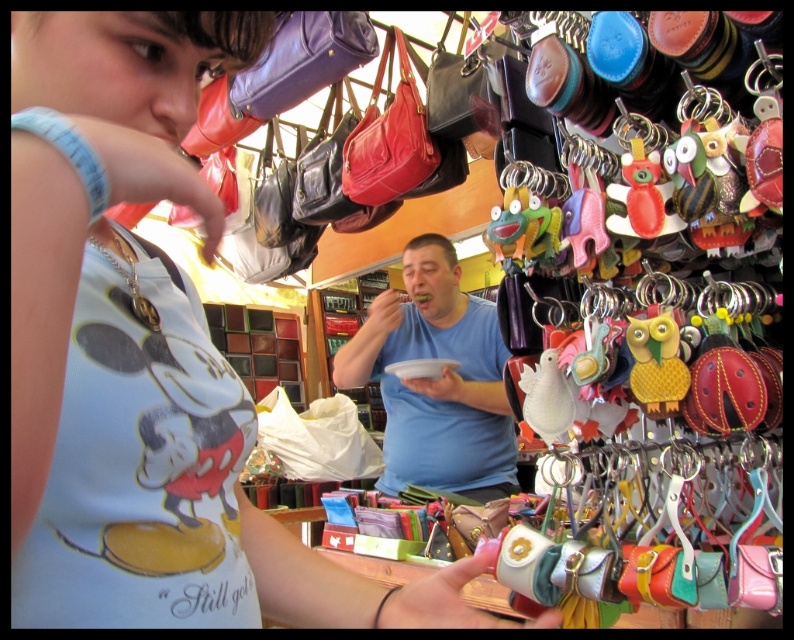
Who is positioned more to the right, matte blue tank top at center or blue matte shirt at center?

From the viewer's perspective, blue matte shirt at center appears more on the right side.

Which is below, matte blue tank top at center or blue matte shirt at center?

matte blue tank top at center is lower down.

Which is behind, point (41, 214) or point (438, 476)?

The point (438, 476) is more distant.

You are a GUI agent. You are given a task and a screenshot of the screen. Output one action in this format:
    pyautogui.click(x=<x>, y=<y>)
    Task: Click on the matte blue tank top at center
    
    Given the screenshot: What is the action you would take?
    pyautogui.click(x=145, y=358)